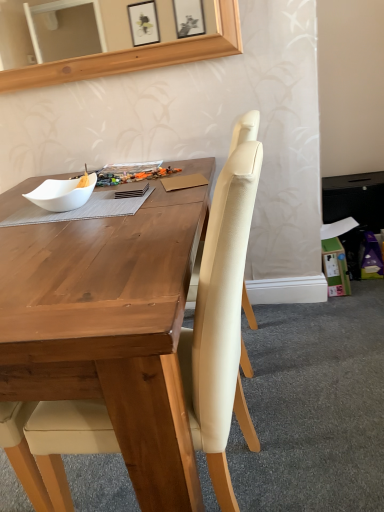
Question: Is beige fabric chair at center positioned with its back to green cardboard box at lower right?

Choices:
 (A) no
 (B) yes

Answer: (A)

Question: Is beige fabric chair at center oriented towards green cardboard box at lower right?

Choices:
 (A) no
 (B) yes

Answer: (A)

Question: Can you confirm if beige fabric chair at center is positioned to the right of green cardboard box at lower right?

Choices:
 (A) no
 (B) yes

Answer: (A)

Question: Is beige fabric chair at center not inside green cardboard box at lower right?

Choices:
 (A) no
 (B) yes

Answer: (B)

Question: Is beige fabric chair at center wider than green cardboard box at lower right?

Choices:
 (A) yes
 (B) no

Answer: (A)

Question: Is the surface of beige fabric chair at center in direct contact with green cardboard box at lower right?

Choices:
 (A) no
 (B) yes

Answer: (A)

Question: From the image's perspective, is beige fabric chair at center on top of white matte bowl at left?

Choices:
 (A) no
 (B) yes

Answer: (A)

Question: From a real-world perspective, is beige fabric chair at center under white matte bowl at left?

Choices:
 (A) no
 (B) yes

Answer: (B)

Question: Is there a large distance between beige fabric chair at center and white matte bowl at left?

Choices:
 (A) no
 (B) yes

Answer: (A)

Question: Is beige fabric chair at center in front of white matte bowl at left?

Choices:
 (A) no
 (B) yes

Answer: (B)

Question: From a real-world perspective, is beige fabric chair at center physically above white matte bowl at left?

Choices:
 (A) no
 (B) yes

Answer: (A)

Question: Does beige fabric chair at center appear on the left side of white matte bowl at left?

Choices:
 (A) no
 (B) yes

Answer: (A)

Question: From a real-world perspective, is green cardboard box at lower right under beige fabric chair at center?

Choices:
 (A) yes
 (B) no

Answer: (A)